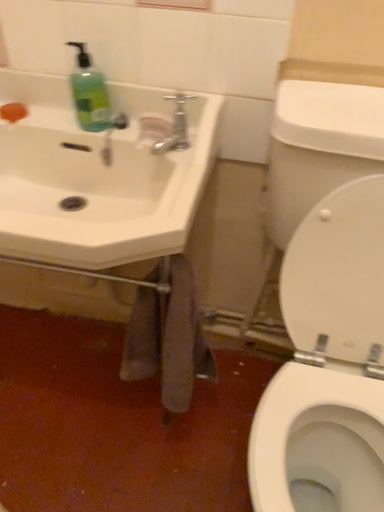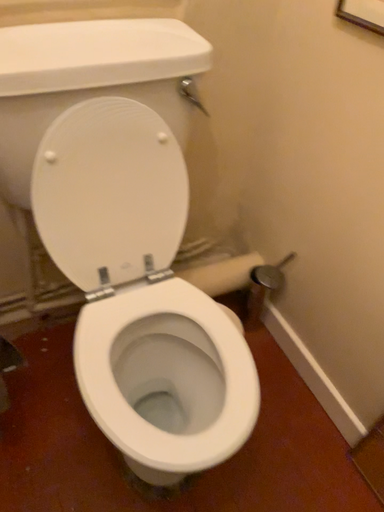
Question: Which way did the camera rotate in the video?

Choices:
 (A) rotated left
 (B) rotated right

Answer: (B)